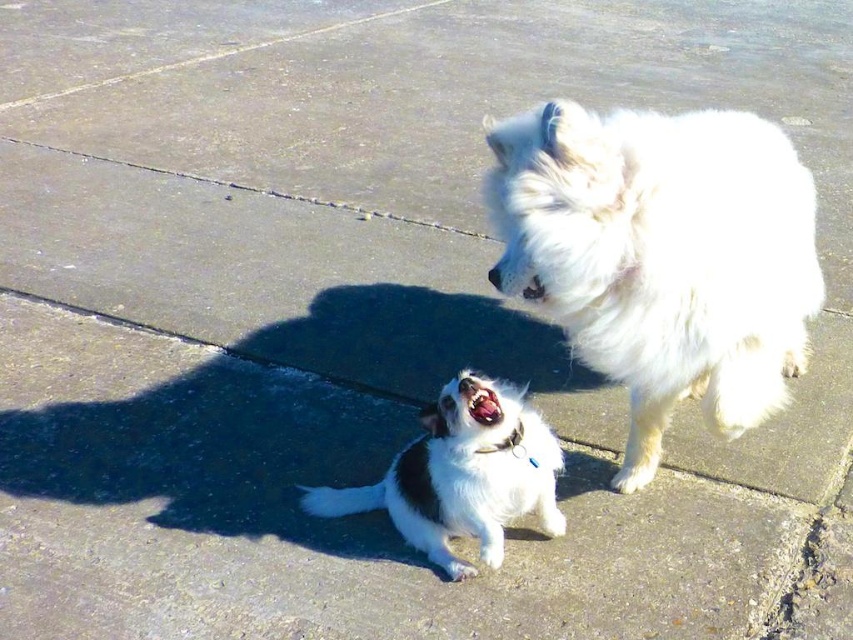
You are a photographer trying to capture both the white fluffy dog at upper right and the white fur dog at center in a single shot. Based on their positions, which dog should you adjust your camera to focus on first to ensure both are in the frame?

The white fluffy dog at upper right is to the right of the white fur dog at center, so you should focus on the white fluffy dog at upper right first to ensure both are within the camera frame.

You are a photographer trying to capture a clear photo of the white fluffy dog at upper right and the white fur dog at center. Which dog should you focus on first to ensure it appears sharp in the photo?

You should focus on the white fluffy dog at upper right first because it is closer to you than the white fur dog at center, so focusing on it will ensure it appears sharp while the background dog may be slightly blurred.

You are a dog trainer observing two dogs in the scene. The white fluffy dog at upper right and the white fur dog at center are both barking. Which dog has a mouth that is open wider?

The white fluffy dog at upper right has a mouth that is open wider because it is taller than the white fur dog at center.